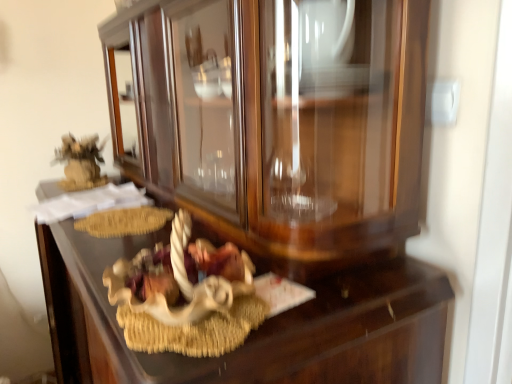
Question: In terms of height, does wooden drawer at center look taller or shorter compared to white matte nativity scene at center?

Choices:
 (A) short
 (B) tall

Answer: (B)

Question: In terms of size, does wooden drawer at center appear bigger or smaller than white matte nativity scene at center?

Choices:
 (A) big
 (B) small

Answer: (A)

Question: Which is correct: wooden drawer at center is inside white matte nativity scene at center, or outside of it?

Choices:
 (A) inside
 (B) outside

Answer: (B)

Question: From a real-world perspective, is white matte nativity scene at center above or below wooden drawer at center?

Choices:
 (A) below
 (B) above

Answer: (B)

Question: Is point (249, 278) closer or farther from the camera than point (176, 380)?

Choices:
 (A) closer
 (B) farther

Answer: (B)

Question: Relative to wooden drawer at center, is white matte nativity scene at center in front or behind?

Choices:
 (A) front
 (B) behind

Answer: (B)

Question: In the image, is white matte nativity scene at center on the left side or the right side of wooden drawer at center?

Choices:
 (A) right
 (B) left

Answer: (A)